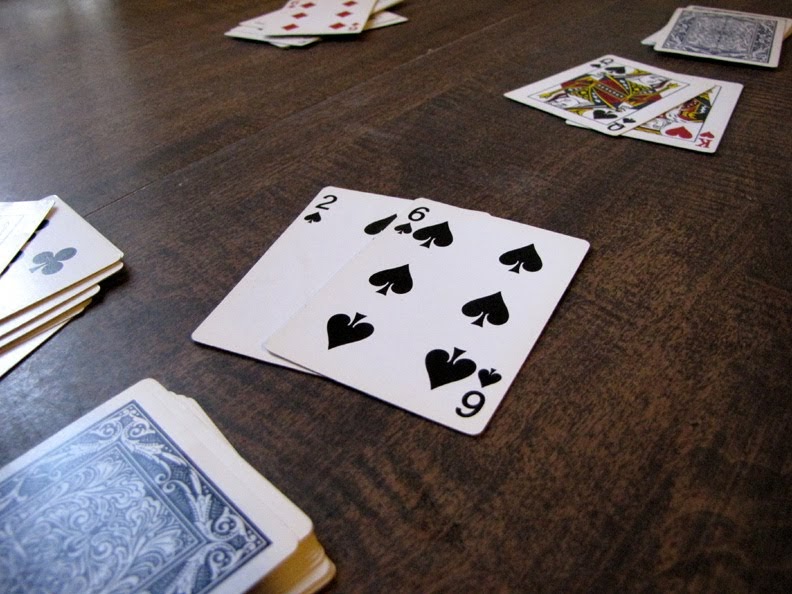
Locate an element on the screen. The width and height of the screenshot is (792, 594). brown wooden table is located at coordinates (575, 495).